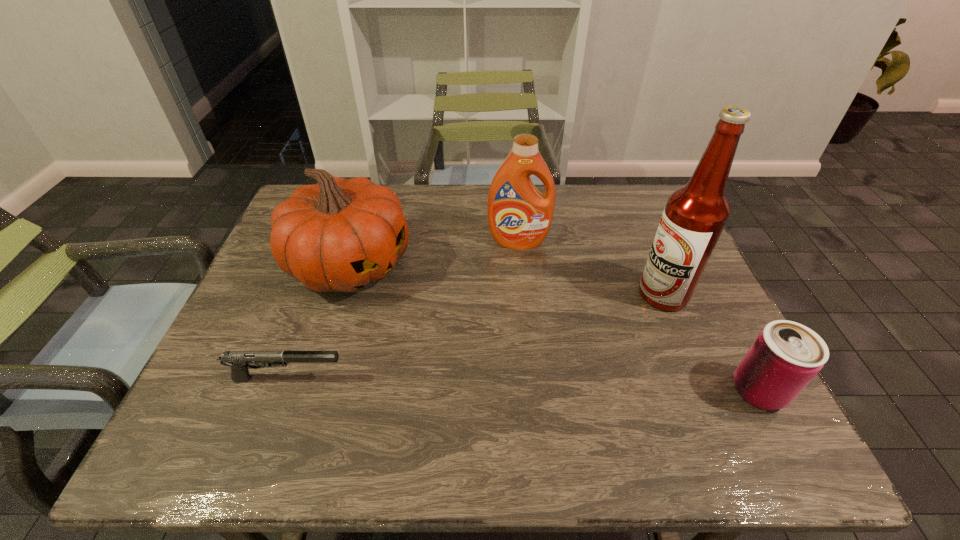
This screenshot has height=540, width=960. Identify the location of vacant space at the right edge of the desktop. (709, 362).

I want to click on free space at the near left corner, so click(x=198, y=405).

Locate an element on the screen. The height and width of the screenshot is (540, 960). vacant region at the far right corner of the desktop is located at coordinates (622, 189).

Identify the location of vacant space that is in between the pumpkin and the detergent. The image size is (960, 540). (434, 253).

In order to click on free space that is in between the can and the pumpkin in this screenshot , I will do `click(555, 328)`.

This screenshot has width=960, height=540. Identify the location of free space between the second tallest object and the tallest object. (590, 268).

At what (x,y) coordinates should I click in order to perform the action: click on vacant area between the detergent and the pumpkin. Please return your answer as a coordinate pair (x, y). Looking at the image, I should click on pyautogui.click(x=434, y=253).

Where is `vacant area between the shortest object and the third object from left to right`? The height and width of the screenshot is (540, 960). vacant area between the shortest object and the third object from left to right is located at coordinates (403, 310).

This screenshot has height=540, width=960. I want to click on vacant area that lies between the can and the third shortest object, so click(x=555, y=328).

This screenshot has height=540, width=960. In order to click on free space that is in between the detergent and the can in this screenshot , I will do `click(638, 316)`.